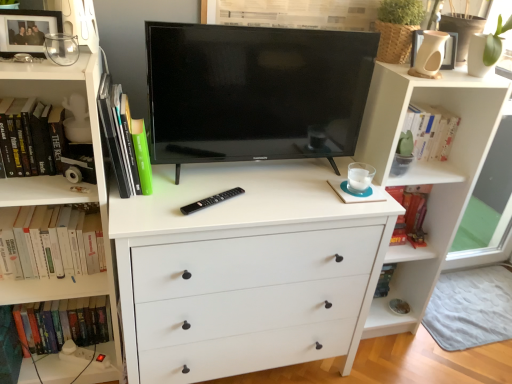
You are a GUI agent. You are given a task and a screenshot of the screen. Output one action in this format:
    pyautogui.click(x=<x>, y=<y>)
    Task: Click on the black glossy tv at center
    The width and height of the screenshot is (512, 384).
    Given the screenshot: What is the action you would take?
    pyautogui.click(x=255, y=92)

Measure the distance between green matte book at left, the 3th book positioned from the bottom, and camera.

green matte book at left, the 3th book positioned from the bottom, and camera are 3.68 feet apart from each other.

The width and height of the screenshot is (512, 384). Describe the element at coordinates (31, 137) in the screenshot. I see `hardcover book at left, the 1th book in the top-to-bottom sequence` at that location.

The width and height of the screenshot is (512, 384). Find the location of `black glossy tv at center`. black glossy tv at center is located at coordinates pyautogui.click(x=255, y=92).

Does point (206, 154) lie in front of point (11, 212)?

That is False.

Which of these two, black glossy tv at center or white hardcover book at left, marked as the second book in a bottom-to-top arrangement, stands taller?

With more height is black glossy tv at center.

You are a GUI agent. You are given a task and a screenshot of the screen. Output one action in this format:
    pyautogui.click(x=<x>, y=<y>)
    Task: Click on the television above the white hardcover book at left, marked as the second book in a bottom-to-top arrangement (from a real-world perspective)
    The image size is (512, 384).
    Given the screenshot: What is the action you would take?
    pyautogui.click(x=255, y=92)

There is a green matte book at left, the 3th book positioned from the bottom. Find the location of `the 2nd book below it (from a real-world perspective)`. the 2nd book below it (from a real-world perspective) is located at coordinates (50, 242).

Is green matte book at left, marked as the second book in a top-to-bottom arrangement, surrounding white hardcover book at left, marked as the second book in a bottom-to-top arrangement?

No, white hardcover book at left, marked as the second book in a bottom-to-top arrangement, is not surrounded by green matte book at left, marked as the second book in a top-to-bottom arrangement.

In the scene shown: Is green matte book at left, marked as the second book in a top-to-bottom arrangement, facing towards white hardcover book at left, the 3th book in the top-to-bottom sequence?

No.

Which point is more distant from viewer, (51,30) or (456,170)?

The point (456,170) is behind.

From the image's perspective, starting from the white matte bookshelf at upper right, which picture frame is the 1st one above? Please provide its 2D coordinates.

[(27, 30)]

Could you tell me if matte black picture frame at upper left, which is the first picture frame in front-to-back order, is turned towards white matte bookshelf at upper right?

No, matte black picture frame at upper left, which is the first picture frame in front-to-back order, is not oriented towards white matte bookshelf at upper right.

Is matte black picture frame at upper left, which ranks as the 2th picture frame in back-to-front order, outside of black plastic remote control at center?

matte black picture frame at upper left, which ranks as the 2th picture frame in back-to-front order, is positioned outside black plastic remote control at center.

Would you consider matte black picture frame at upper left, the 1th picture frame positioned from the left, to be distant from black plastic remote control at center?

No, there isn't a large distance between matte black picture frame at upper left, the 1th picture frame positioned from the left, and black plastic remote control at center.

Which of these two, matte black picture frame at upper left, positioned as the 2th picture frame in right-to-left order, or black plastic remote control at center, is smaller?

black plastic remote control at center is smaller.

Does hardcover book at left, the 1th book in the top-to-bottom sequence, contain white matte bookshelf at upper right?

No, white matte bookshelf at upper right is not inside hardcover book at left, the 1th book in the top-to-bottom sequence.

From a real-world perspective, is hardcover book at left, positioned as the 4th book in bottom-to-top order, under white matte bookshelf at upper right?

No, from a real-world perspective, hardcover book at left, positioned as the 4th book in bottom-to-top order, is not under white matte bookshelf at upper right.

In the scene shown: Is hardcover book at left, positioned as the 4th book in bottom-to-top order, next to white matte bookshelf at upper right?

No, hardcover book at left, positioned as the 4th book in bottom-to-top order, is not next to white matte bookshelf at upper right.

Is hardcover book at left, the 1th book in the top-to-bottom sequence, wider or thinner than white matte bookshelf at upper right?

In the image, hardcover book at left, the 1th book in the top-to-bottom sequence, appears to be wider than white matte bookshelf at upper right.

How many degrees apart are the facing directions of hardcover book at left, the 1th book in the top-to-bottom sequence, and black glossy tv at center?

There is a 3.67-degree angle between the facing directions of hardcover book at left, the 1th book in the top-to-bottom sequence, and black glossy tv at center.

Does hardcover book at left, the 1th book in the top-to-bottom sequence, have a greater height compared to black glossy tv at center?

Incorrect, the height of hardcover book at left, the 1th book in the top-to-bottom sequence, is not larger of that of black glossy tv at center.

Between point (14, 169) and point (340, 98), which one is positioned in front?

The point (14, 169) is closer to the camera.

In order to click on television above the hardcover book at left, the 1th book in the top-to-bottom sequence (from the image's perspective) in this screenshot , I will do point(255,92).

Could you tell me if green matte book at left, the 3th book positioned from the bottom, is turned towards matte black picture frame at upper left, positioned as the 2th picture frame in right-to-left order?

No, green matte book at left, the 3th book positioned from the bottom, is not turned towards matte black picture frame at upper left, positioned as the 2th picture frame in right-to-left order.

Is green matte book at left, the 3th book positioned from the bottom, directly adjacent to matte black picture frame at upper left, which ranks as the 2th picture frame in back-to-front order?

No.

Who is bigger, green matte book at left, the 3th book positioned from the bottom, or matte black picture frame at upper left, which ranks as the 2th picture frame in back-to-front order?

green matte book at left, the 3th book positioned from the bottom.

Can you tell me how much green matte book at left, marked as the second book in a top-to-bottom arrangement, and matte black picture frame at upper left, the 1th picture frame positioned from the left, differ in facing direction?

The angular difference between green matte book at left, marked as the second book in a top-to-bottom arrangement, and matte black picture frame at upper left, the 1th picture frame positioned from the left, is 79 degrees.

Identify the location of television above the white hardcover book at left, the 3th book in the top-to-bottom sequence (from a real-world perspective). The image size is (512, 384). (255, 92).

I want to click on book that is the 2nd object located behind the green matte book at left, the 3th book positioned from the bottom, so (x=50, y=242).

Looking at the image, which one is located closer to matte white picture frame at upper right, which appears as the second picture frame when viewed from the left, white matte chest of drawers at center or green matte book at left, marked as the second book in a top-to-bottom arrangement?

Among the two, white matte chest of drawers at center is located nearer to matte white picture frame at upper right, which appears as the second picture frame when viewed from the left.

Which object lies further to the anchor point white hardcover book at left, the 3th book in the top-to-bottom sequence, hardcover book at left, marked as the first book in a bottom-to-top arrangement, or black glossy tv at center?

black glossy tv at center lies further to white hardcover book at left, the 3th book in the top-to-bottom sequence, than the other object.

Based on their spatial positions, is green matte book at left, marked as the second book in a top-to-bottom arrangement, or white matte chest of drawers at center closer to matte black picture frame at upper left, which is the first picture frame in front-to-back order?

green matte book at left, marked as the second book in a top-to-bottom arrangement, lies closer to matte black picture frame at upper left, which is the first picture frame in front-to-back order, than the other object.

Looking at the image, which one is located further to hardcover book at left, positioned as the 4th book in bottom-to-top order, green matte book at left, the 3th book positioned from the bottom, or hardcover book at left, acting as the fourth book starting from the top?

hardcover book at left, acting as the fourth book starting from the top, lies further to hardcover book at left, positioned as the 4th book in bottom-to-top order, than the other object.

Looking at the image, which one is located further to white matte bookshelf at upper right, black glossy tv at center or white hardcover book at left, marked as the second book in a bottom-to-top arrangement?

white hardcover book at left, marked as the second book in a bottom-to-top arrangement.

Estimate the real-world distances between objects in this image. Which object is closer to white hardcover book at left, the 3th book in the top-to-bottom sequence, matte white picture frame at upper right, which is counted as the first picture frame, starting from the right, or white matte chest of drawers at center?

white matte chest of drawers at center lies closer to white hardcover book at left, the 3th book in the top-to-bottom sequence, than the other object.

Looking at the image, which one is located closer to hardcover book at left, acting as the fourth book starting from the top, white matte bookshelf at upper right or green matte book at left, the 3th book positioned from the bottom?

green matte book at left, the 3th book positioned from the bottom, is closer to hardcover book at left, acting as the fourth book starting from the top.

Looking at the image, which one is located closer to white hardcover book at left, marked as the second book in a bottom-to-top arrangement, green matte book at left, the 3th book positioned from the bottom, or black glossy tv at center?

green matte book at left, the 3th book positioned from the bottom, is positioned closer to the anchor white hardcover book at left, marked as the second book in a bottom-to-top arrangement.

Identify the location of the chest of drawers located between white hardcover book at left, marked as the second book in a bottom-to-top arrangement, and matte white picture frame at upper right, acting as the second picture frame starting from the front, in the left-right direction. This screenshot has width=512, height=384. (244, 271).

Where is `flat between hardcover book at left, marked as the first book in a bottom-to-top arrangement, and black glossy tv at center from left to right`? The image size is (512, 384). flat between hardcover book at left, marked as the first book in a bottom-to-top arrangement, and black glossy tv at center from left to right is located at coordinates (211, 201).

Where is `picture frame situated between green matte book at left, the 3th book positioned from the bottom, and white matte bookshelf at upper right from left to right`? The height and width of the screenshot is (384, 512). picture frame situated between green matte book at left, the 3th book positioned from the bottom, and white matte bookshelf at upper right from left to right is located at coordinates (450, 52).

This screenshot has height=384, width=512. What are the coordinates of `flat between matte black picture frame at upper left, which is the first picture frame in front-to-back order, and white matte chest of drawers at center vertically` in the screenshot? It's located at (211, 201).